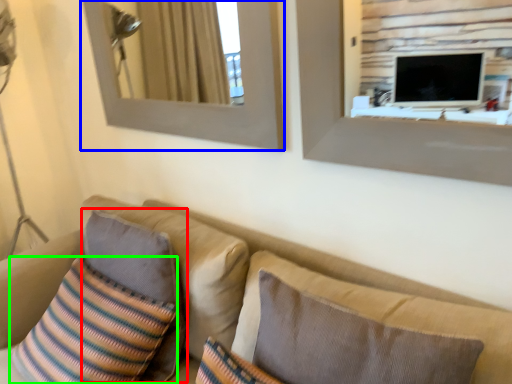
Question: Estimate the real-world distances between objects in this image. Which object is farther from pillow (highlighted by a red box), picture frame (highlighted by a blue box) or throw pillow (highlighted by a green box)?

Choices:
 (A) picture frame
 (B) throw pillow

Answer: (A)